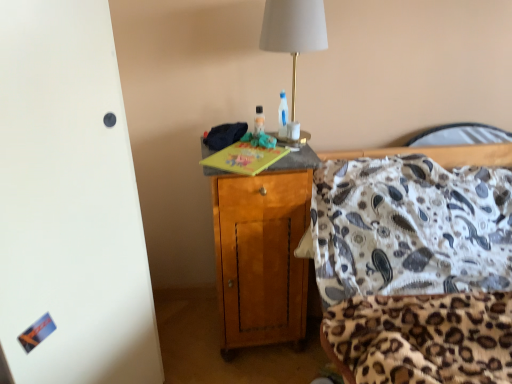
This screenshot has height=384, width=512. What are the coordinates of `wooden cabinet at center` in the screenshot? It's located at (262, 252).

From a real-world perspective, which object rests below the other?

From a 3D spatial view, translucent plastic bottle at center is below.

Consider the image. Is white fabric lampshade at upper center inside the boundaries of translucent plastic bottle at center, or outside?

The correct answer is: outside.

You are a GUI agent. You are given a task and a screenshot of the screen. Output one action in this format:
    pyautogui.click(x=<x>, y=<y>)
    Task: Click on the lamp that is in front of the translucent plastic bottle at center
    The image size is (512, 384).
    Given the screenshot: What is the action you would take?
    pyautogui.click(x=293, y=30)

From a real-world perspective, is white fabric lampshade at upper center located beneath wooden cabinet at center?

Incorrect, from a real-world perspective, white fabric lampshade at upper center is higher than wooden cabinet at center.

In terms of width, does white fabric lampshade at upper center look wider or thinner when compared to wooden cabinet at center?

Considering their sizes, white fabric lampshade at upper center looks slimmer than wooden cabinet at center.

Is white fabric lampshade at upper center shorter than wooden cabinet at center?

Correct, white fabric lampshade at upper center is not as tall as wooden cabinet at center.

From a real-world perspective, does wooden cabinet at center stand above translucent plastic bottle at center?

Actually, wooden cabinet at center is physically below translucent plastic bottle at center in the real world.

This screenshot has width=512, height=384. In order to click on bottle above the wooden cabinet at center (from the image's perspective) in this screenshot , I will do `click(259, 121)`.

Is wooden cabinet at center wider or thinner than translucent plastic bottle at center?

Clearly, wooden cabinet at center has more width compared to translucent plastic bottle at center.

Is translucent plastic bottle at center not within wooden cabinet at center?

translucent plastic bottle at center lies outside wooden cabinet at center's area.

From a real-world perspective, is translucent plastic bottle at center physically above wooden cabinet at center?

Correct, in the physical world, translucent plastic bottle at center is higher than wooden cabinet at center.

From the picture: Is translucent plastic bottle at center further to the viewer compared to wooden cabinet at center?

Yes, it is behind wooden cabinet at center.

Does translucent plastic bottle at center appear on the right side of wooden cabinet at center?

Yes, translucent plastic bottle at center is to the right of wooden cabinet at center.

Visually, is wooden cabinet at center positioned to the left or to the right of white fabric lampshade at upper center?

Based on their positions, wooden cabinet at center is located to the left of white fabric lampshade at upper center.

Based on the photo, which is less distant, (286, 165) or (313, 7)?

The point (313, 7) is closer.

Is wooden cabinet at center far away from white fabric lampshade at upper center?

That's not correct — wooden cabinet at center is a little close to white fabric lampshade at upper center.

How different are the orientations of translucent plastic bottle at center and white fabric lampshade at upper center in degrees?

The facing directions of translucent plastic bottle at center and white fabric lampshade at upper center are 8 degrees apart.

Relative to white fabric lampshade at upper center, is translucent plastic bottle at center in front or behind?

translucent plastic bottle at center is behind white fabric lampshade at upper center.

Is translucent plastic bottle at center aimed at white fabric lampshade at upper center?

Yes, translucent plastic bottle at center is turned towards white fabric lampshade at upper center.

Locate an element on the screen. bottle on the left of the white fabric lampshade at upper center is located at coordinates click(259, 121).

Identify the location of lamp on the right of wooden cabinet at center. (293, 30).

Looking at the image, which one is located closer to translucent plastic bottle at center, wooden cabinet at center or white fabric lampshade at upper center?

Based on the image, white fabric lampshade at upper center appears to be nearer to translucent plastic bottle at center.

Considering their positions, is wooden cabinet at center positioned closer to white fabric lampshade at upper center than translucent plastic bottle at center?

Based on the image, translucent plastic bottle at center appears to be nearer to white fabric lampshade at upper center.

Considering their positions, is translucent plastic bottle at center positioned closer to wooden cabinet at center than white fabric lampshade at upper center?

Based on the image, translucent plastic bottle at center appears to be nearer to wooden cabinet at center.

In the scene shown: Considering their positions, is translucent plastic bottle at center positioned closer to white fabric lampshade at upper center than wooden cabinet at center?

translucent plastic bottle at center.

Estimate the real-world distances between objects in this image. Which object is further from translucent plastic bottle at center, white fabric lampshade at upper center or wooden cabinet at center?

Based on the image, wooden cabinet at center appears to be further to translucent plastic bottle at center.

From the image, which object appears to be nearer to wooden cabinet at center, white fabric lampshade at upper center or translucent plastic bottle at center?

The object closer to wooden cabinet at center is translucent plastic bottle at center.

In order to click on bottle between white fabric lampshade at upper center and wooden cabinet at center from top to bottom in this screenshot , I will do `click(259, 121)`.